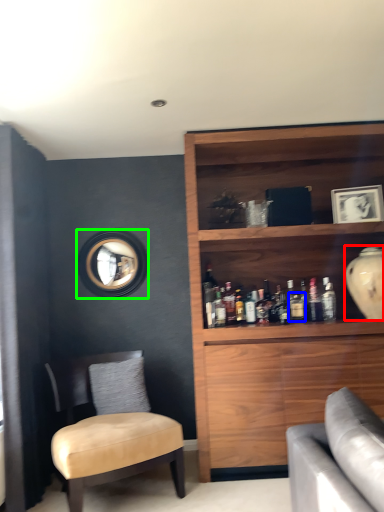
Question: Which object is positioned farthest from glass vase (highlighted by a red box)? Select from beverage (highlighted by a blue box) and mirror (highlighted by a green box).

Choices:
 (A) beverage
 (B) mirror

Answer: (B)